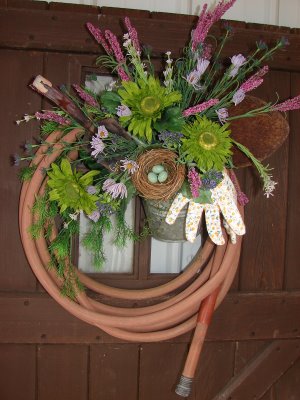
The height and width of the screenshot is (400, 300). I want to click on 1 white wall, so click(x=259, y=7).